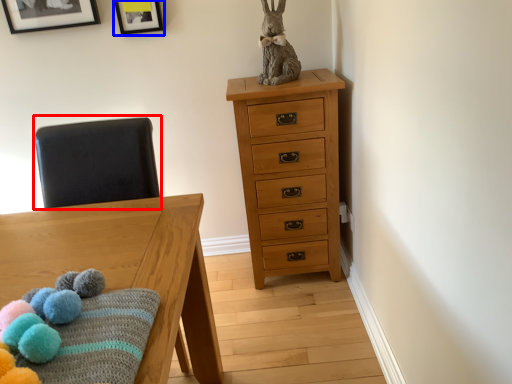
Question: Among these objects, which one is nearest to the camera, swivel chair (highlighted by a red box) or picture frame (highlighted by a blue box)?

Choices:
 (A) swivel chair
 (B) picture frame

Answer: (A)